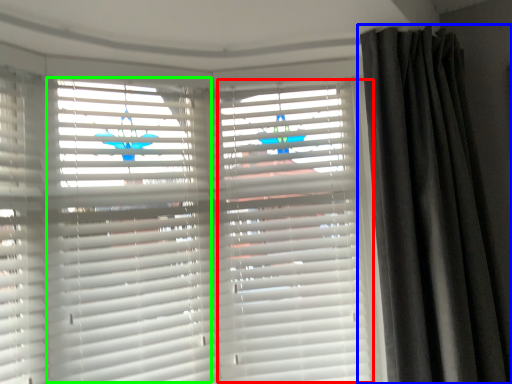
Question: Estimate the real-world distances between objects in this image. Which object is farther from shutter (highlighted by a red box), curtain (highlighted by a blue box) or shutter (highlighted by a green box)?

Choices:
 (A) curtain
 (B) shutter

Answer: (B)